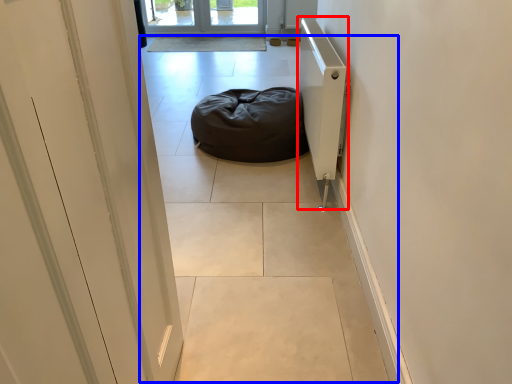
Question: Which object appears closest to the camera in this image, radiator (highlighted by a red box) or path (highlighted by a blue box)?

Choices:
 (A) radiator
 (B) path

Answer: (B)